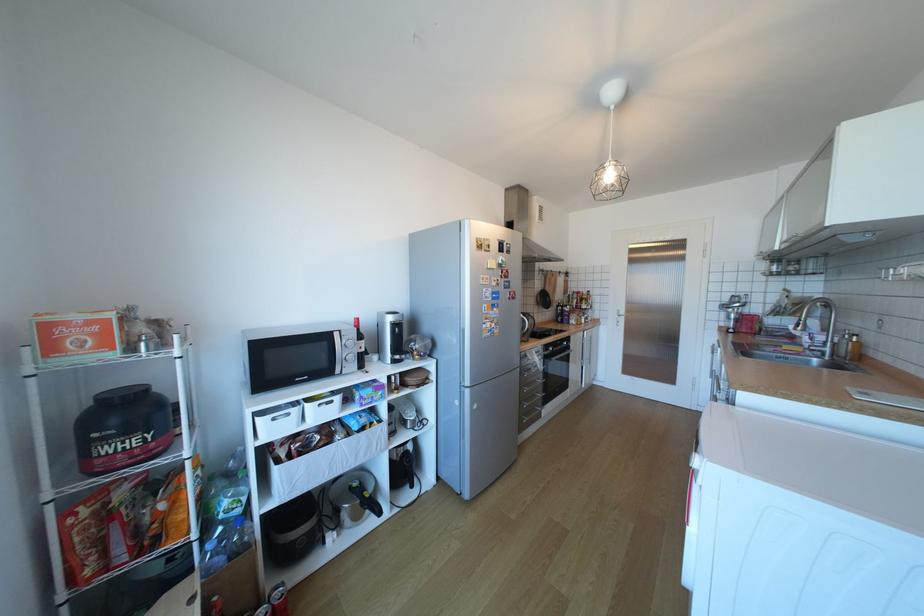
The image size is (924, 616). Identify the location of microwave door handle. (337, 352).